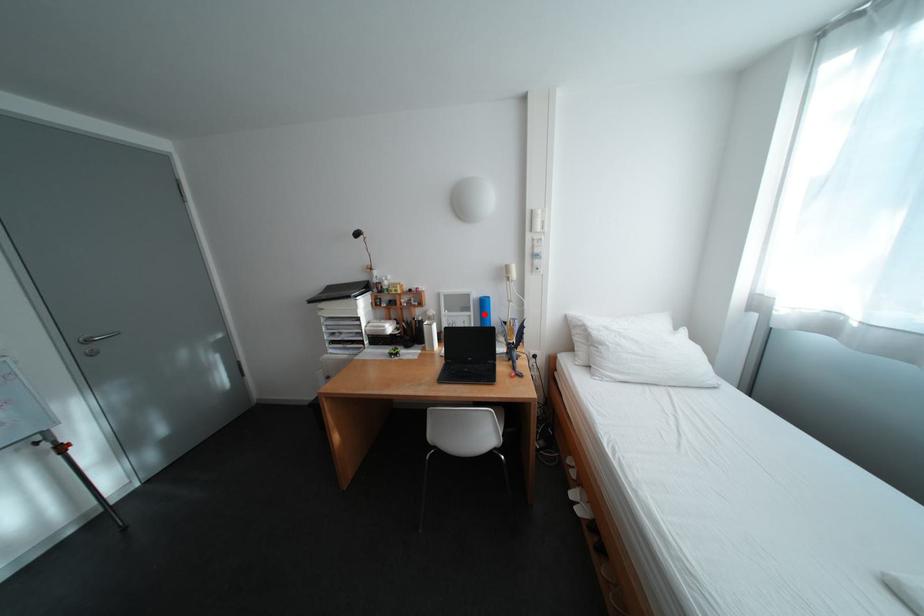
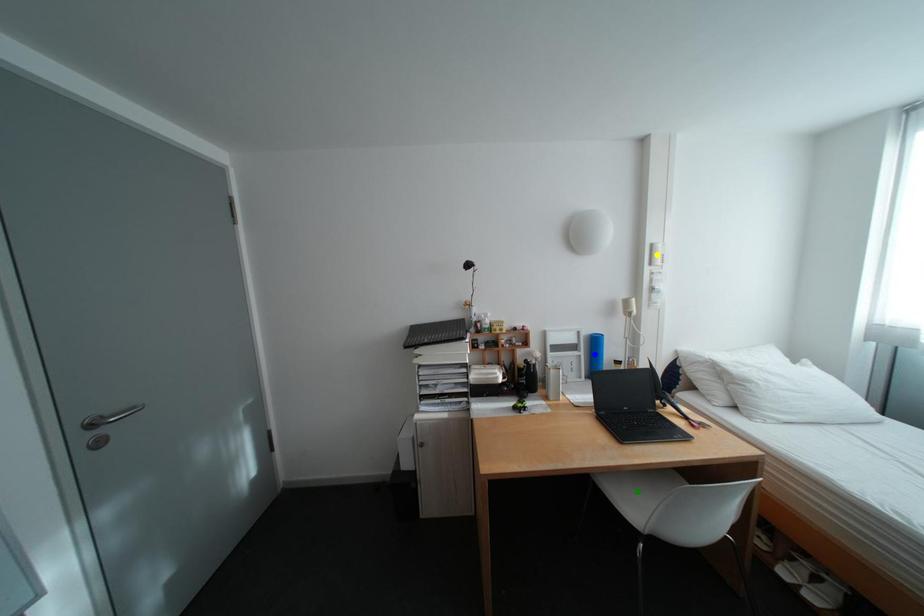
Question: I am providing you with two images of the same scene from different viewpoints. A red point is marked on the first image. You are given multiple points on the second image. Can you choose the point in image 2 that corresponds to the point in image 1?

Choices:
 (A) blue point
 (B) green point
 (C) yellow point

Answer: (A)